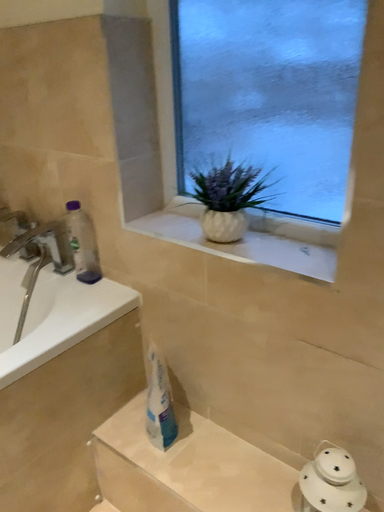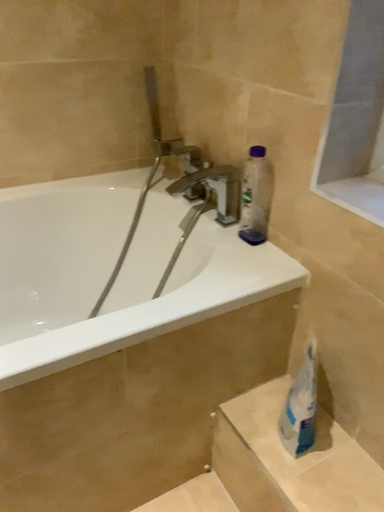
Question: Which way did the camera rotate in the video?

Choices:
 (A) rotated left
 (B) rotated right

Answer: (A)